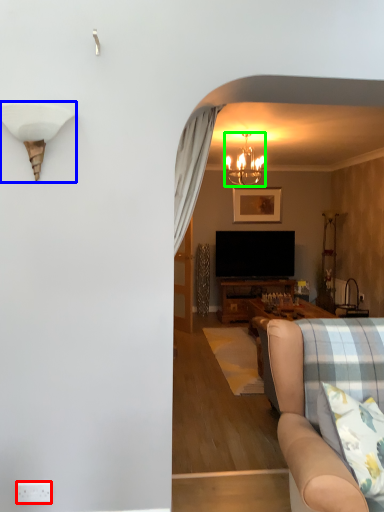
Question: Which object is the closest to the power outlet (highlighted by a red box)? Choose among these: lamp (highlighted by a blue box) or lamp (highlighted by a green box).

Choices:
 (A) lamp
 (B) lamp

Answer: (A)